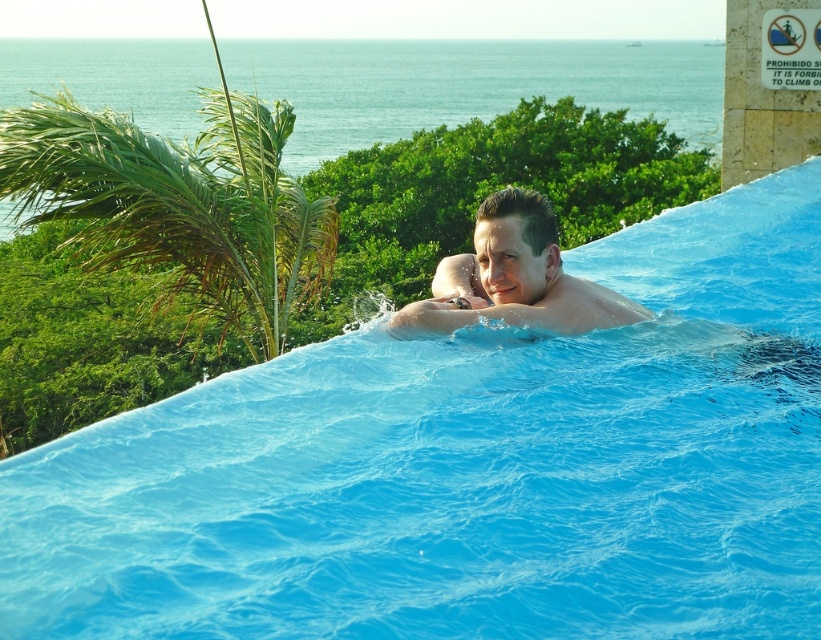
You are standing at the edge of the infinity pool and want to locate the point marked at coordinates (179, 204). Based on the scene, where would this point be located?

The point marked at coordinates (179, 204) is located on the green leafy palm tree at upper left.

You are standing at the edge of the vibrant blue infinity pool and want to locate the green leafy palm tree at upper left. Based on the coordinates provided, in which direction should you look to find it?

The green leafy palm tree at upper left is located at point (x=179, y=204), which means you should look towards the upper left direction to find it.